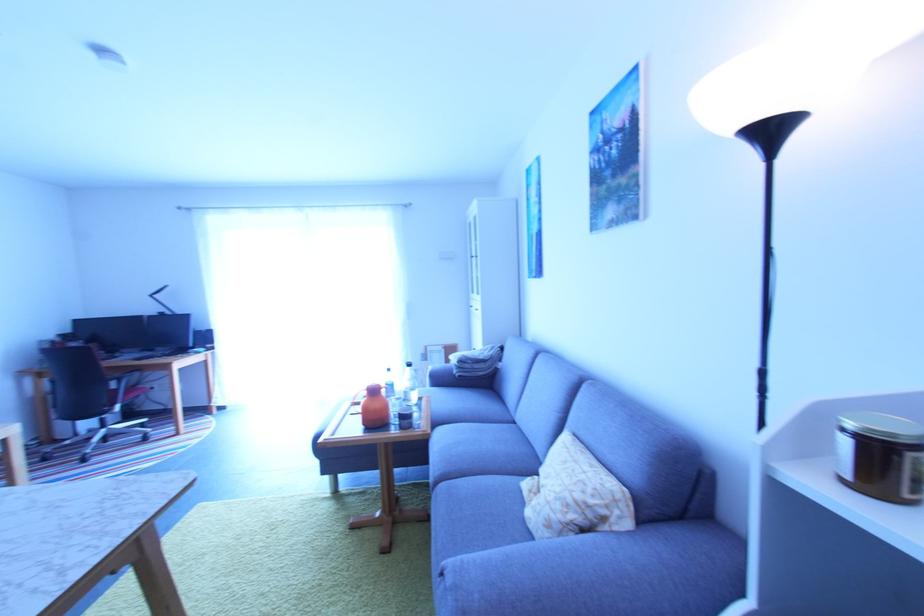
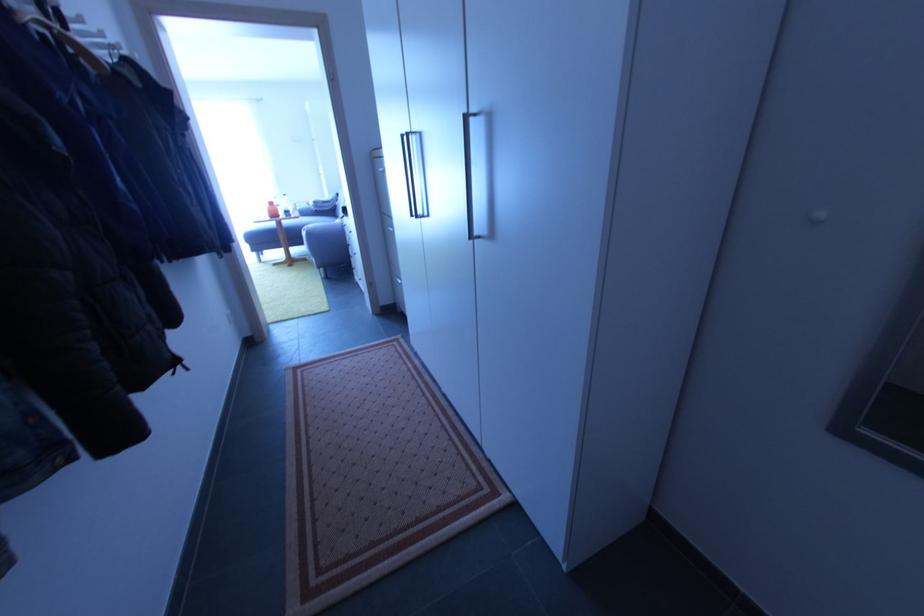
In the second image, find the point that corresponds to pixel 379 392 in the first image.

(275, 205)